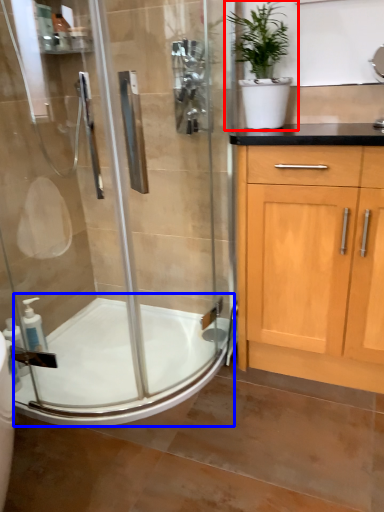
Question: Among these objects, which one is farthest to the camera, houseplant (highlighted by a red box) or bath (highlighted by a blue box)?

Choices:
 (A) houseplant
 (B) bath

Answer: (B)